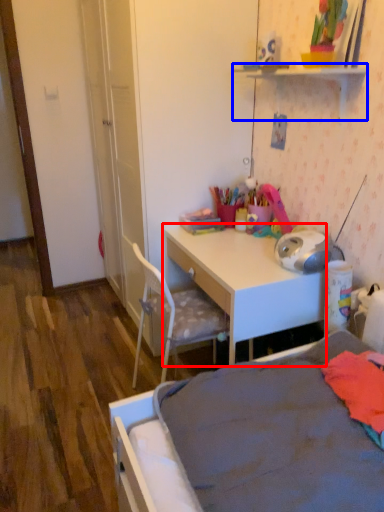
Question: Among these objects, which one is nearest to the camera, desk (highlighted by a red box) or shelf (highlighted by a blue box)?

Choices:
 (A) desk
 (B) shelf

Answer: (B)